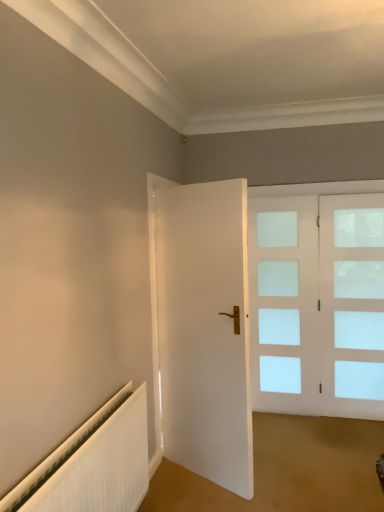
Question: Is white ribbed radiator at lower left further to the viewer compared to clear glass door at right?

Choices:
 (A) no
 (B) yes

Answer: (A)

Question: From a real-world perspective, is white ribbed radiator at lower left below clear glass door at right?

Choices:
 (A) yes
 (B) no

Answer: (A)

Question: From the image's perspective, is white ribbed radiator at lower left located beneath clear glass door at right?

Choices:
 (A) yes
 (B) no

Answer: (A)

Question: Is white ribbed radiator at lower left taller than clear glass door at right?

Choices:
 (A) no
 (B) yes

Answer: (A)

Question: Can you confirm if white ribbed radiator at lower left is smaller than clear glass door at right?

Choices:
 (A) no
 (B) yes

Answer: (A)

Question: Considering the positions of white matte door at center and clear glass door at right in the image, is white matte door at center taller or shorter than clear glass door at right?

Choices:
 (A) tall
 (B) short

Answer: (A)

Question: Is white matte door at center to the left or to the right of clear glass door at right in the image?

Choices:
 (A) left
 (B) right

Answer: (A)

Question: Is white matte door at center inside or outside of clear glass door at right?

Choices:
 (A) inside
 (B) outside

Answer: (B)

Question: Considering their positions, is white matte door at center located in front of or behind clear glass door at right?

Choices:
 (A) front
 (B) behind

Answer: (A)

Question: From the image's perspective, is white ribbed radiator at lower left located above or below clear glass door at right?

Choices:
 (A) below
 (B) above

Answer: (A)

Question: In terms of size, does white ribbed radiator at lower left appear bigger or smaller than clear glass door at right?

Choices:
 (A) small
 (B) big

Answer: (B)

Question: From their relative heights in the image, would you say white ribbed radiator at lower left is taller or shorter than clear glass door at right?

Choices:
 (A) short
 (B) tall

Answer: (A)

Question: Is white ribbed radiator at lower left spatially inside clear glass door at right, or outside of it?

Choices:
 (A) outside
 (B) inside

Answer: (A)

Question: From a real-world perspective, relative to white matte door at center, is clear glass door at right vertically above or below?

Choices:
 (A) above
 (B) below

Answer: (B)

Question: Is point (337, 389) positioned closer to the camera than point (168, 237)?

Choices:
 (A) closer
 (B) farther

Answer: (B)